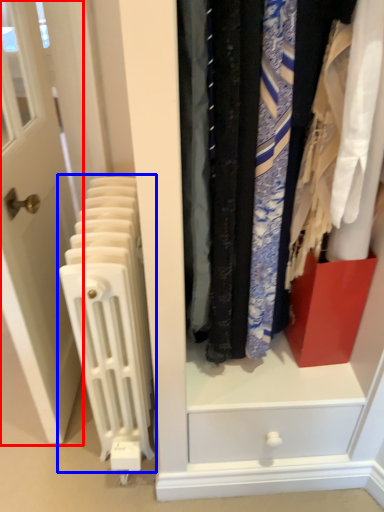
Question: Which point is further to the camera, door (highlighted by a red box) or radiator (highlighted by a blue box)?

Choices:
 (A) door
 (B) radiator

Answer: (B)